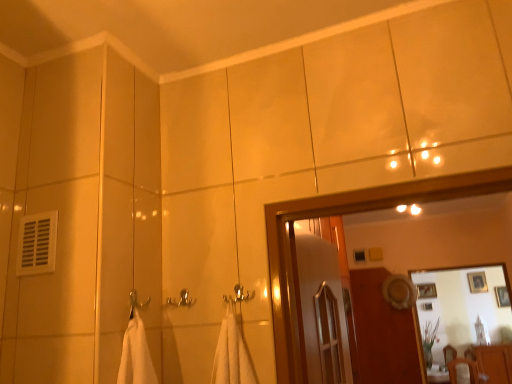
Question: Is wooden screen door at center to the right of glossy wooden mirror at upper center from the viewer's perspective?

Choices:
 (A) yes
 (B) no

Answer: (B)

Question: Is glossy wooden mirror at upper center completely or partially inside wooden screen door at center?

Choices:
 (A) yes
 (B) no

Answer: (B)

Question: Considering the relative positions of wooden screen door at center and glossy wooden mirror at upper center in the image provided, is wooden screen door at center to the left of glossy wooden mirror at upper center from the viewer's perspective?

Choices:
 (A) yes
 (B) no

Answer: (A)

Question: From a real-world perspective, is wooden screen door at center positioned over glossy wooden mirror at upper center based on gravity?

Choices:
 (A) yes
 (B) no

Answer: (B)

Question: Can you confirm if wooden screen door at center is bigger than glossy wooden mirror at upper center?

Choices:
 (A) yes
 (B) no

Answer: (A)

Question: From a real-world perspective, relative to glossy wooden mirror at upper center, is matte brown dresser at lower right vertically above or below?

Choices:
 (A) below
 (B) above

Answer: (A)

Question: Based on their positions, is matte brown dresser at lower right located to the left or right of glossy wooden mirror at upper center?

Choices:
 (A) left
 (B) right

Answer: (B)

Question: From the image's perspective, is matte brown dresser at lower right positioned above or below glossy wooden mirror at upper center?

Choices:
 (A) above
 (B) below

Answer: (B)

Question: Is matte brown dresser at lower right wider or thinner than glossy wooden mirror at upper center?

Choices:
 (A) wide
 (B) thin

Answer: (A)

Question: Does point (494, 367) appear closer or farther from the camera than point (481, 278)?

Choices:
 (A) farther
 (B) closer

Answer: (B)

Question: Is matte brown dresser at lower right spatially inside wooden framed picture at upper right, placed as the 1th picture frame when sorted from left to right, or outside of it?

Choices:
 (A) outside
 (B) inside

Answer: (A)

Question: In the image, is matte brown dresser at lower right positioned in front of or behind wooden framed picture at upper right, placed as the 1th picture frame when sorted from left to right?

Choices:
 (A) behind
 (B) front

Answer: (B)

Question: Considering the positions of matte brown dresser at lower right and wooden framed picture at upper right, placed as the 1th picture frame when sorted from left to right, in the image, is matte brown dresser at lower right bigger or smaller than wooden framed picture at upper right, placed as the 1th picture frame when sorted from left to right,?

Choices:
 (A) big
 (B) small

Answer: (A)

Question: Considering their positions, is wooden framed picture at upper right, which appears as the second picture frame when viewed from the left, located in front of or behind matte brown dresser at lower right?

Choices:
 (A) behind
 (B) front

Answer: (A)

Question: Does point (495, 289) appear closer or farther from the camera than point (490, 375)?

Choices:
 (A) farther
 (B) closer

Answer: (A)